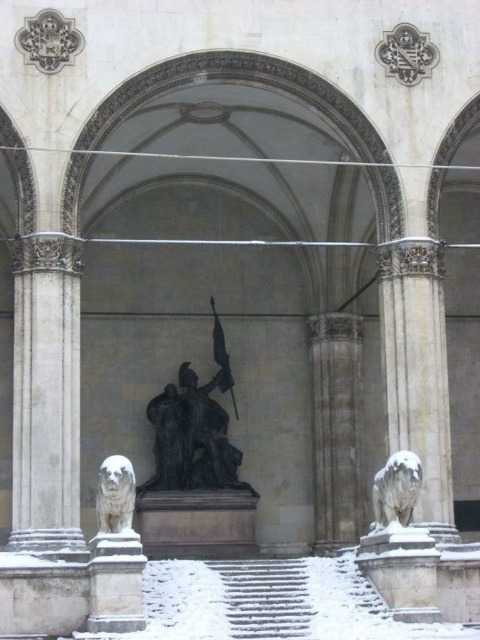
Does point (380, 477) come farther from viewer compared to point (97, 524)?

No, it is not.

Is point (412, 456) less distant than point (128, 468)?

No, it is behind (128, 468).

Find the location of `white marble lion at lower right`. white marble lion at lower right is located at coordinates (396, 490).

Does white marble lion at right appear on the left side of gray stone column at center?

In fact, white marble lion at right is to the right of gray stone column at center.

From the picture: Can you confirm if white marble lion at right is positioned below gray stone column at center?

No.

Is point (420, 385) positioned before point (324, 326)?

Yes, point (420, 385) is in front of point (324, 326).

Where is `white marble lion at right`? white marble lion at right is located at coordinates (418, 369).

Based on the photo, is gray stone column at center behind white marble dog at center?

Yes, gray stone column at center is further from the viewer.

Which of these two, gray stone column at center or white marble dog at center, stands taller?

gray stone column at center is taller.

Which is in front, point (345, 433) or point (124, 515)?

Point (124, 515)

Image resolution: width=480 pixels, height=640 pixels. In order to click on gray stone column at center in this screenshot , I will do `click(336, 428)`.